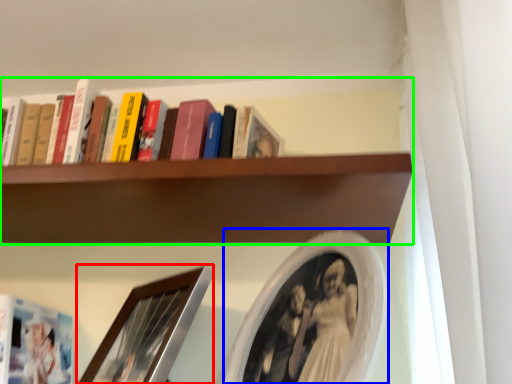
Question: Which object is the farthest from picture frame (highlighted by a red box)? Choose among these: picture frame (highlighted by a blue box) or shelf (highlighted by a green box).

Choices:
 (A) picture frame
 (B) shelf

Answer: (B)